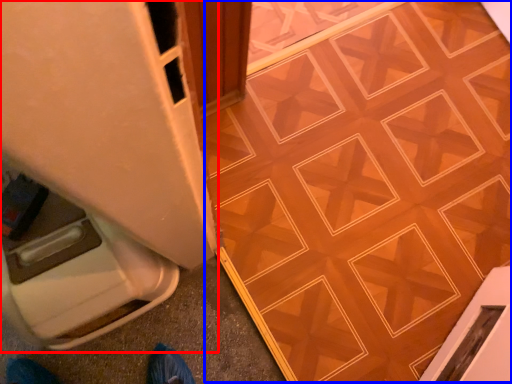
Question: Which point is further to the camera, appliance (highlighted by a red box) or ceramic tile (highlighted by a blue box)?

Choices:
 (A) appliance
 (B) ceramic tile

Answer: (B)